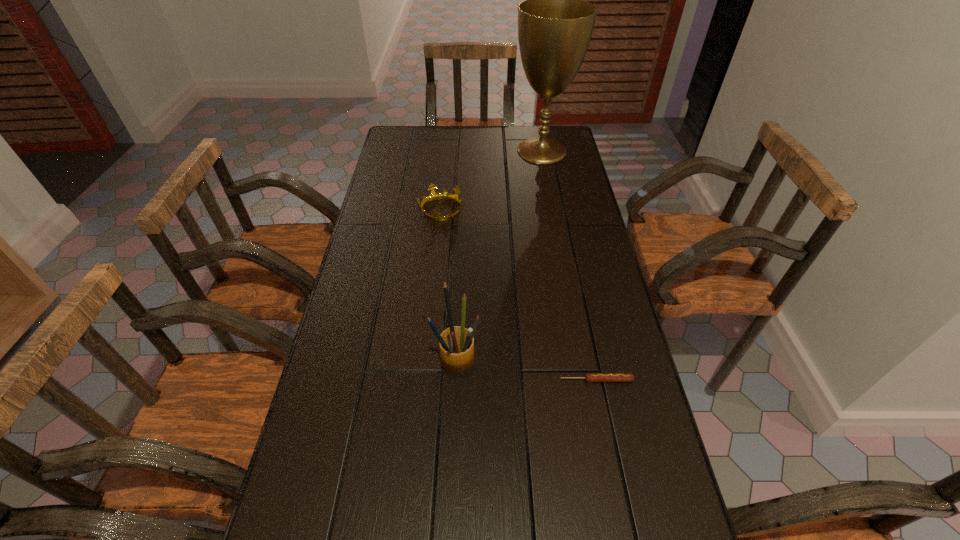
Identify the location of object positioned at the far edge. (555, 24).

The width and height of the screenshot is (960, 540). Find the location of `trophy cup present at the right edge`. trophy cup present at the right edge is located at coordinates (555, 24).

At what (x,y) coordinates should I click in order to perform the action: click on sausage at the right edge. Please return your answer as a coordinate pair (x, y). This screenshot has height=540, width=960. Looking at the image, I should click on (589, 377).

Find the location of a particular element. This screenshot has height=540, width=960. object that is at the far right corner is located at coordinates (555, 24).

Find the location of `vacant space at the far edge of the desktop`. vacant space at the far edge of the desktop is located at coordinates (496, 132).

Find the location of a particular element. vacant region at the left edge is located at coordinates (376, 389).

In the image, there is a desktop. Where is `vacant region at the right edge`? The image size is (960, 540). vacant region at the right edge is located at coordinates (552, 184).

The image size is (960, 540). What are the coordinates of `vacant space at the far left corner of the desktop` in the screenshot? It's located at (396, 137).

Image resolution: width=960 pixels, height=540 pixels. I want to click on empty space that is in between the third shortest object and the farthest object, so pyautogui.click(x=499, y=255).

Where is `empty space between the pencil box and the tallest object`? This screenshot has height=540, width=960. empty space between the pencil box and the tallest object is located at coordinates (499, 255).